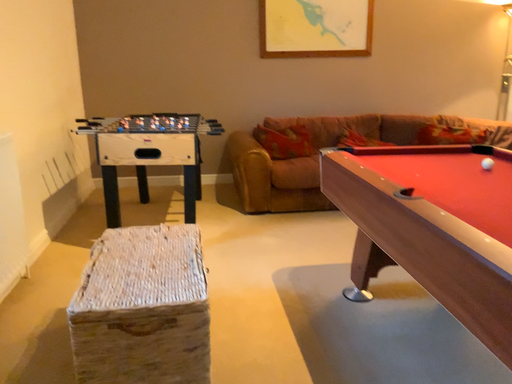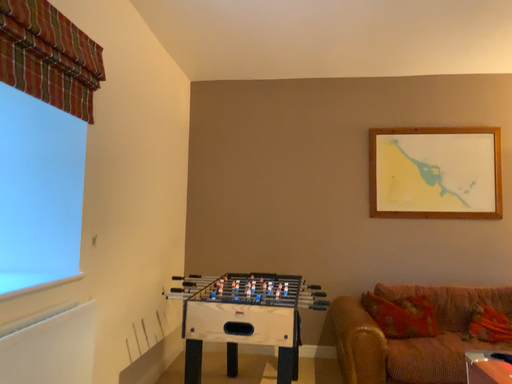
Question: How did the camera likely rotate when shooting the video?

Choices:
 (A) rotated left
 (B) rotated right

Answer: (A)